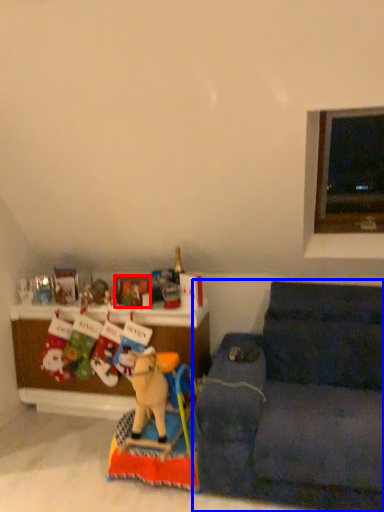
Question: Which of the following is the farthest to the observer, picture frame (highlighted by a red box) or studio couch (highlighted by a blue box)?

Choices:
 (A) picture frame
 (B) studio couch

Answer: (A)